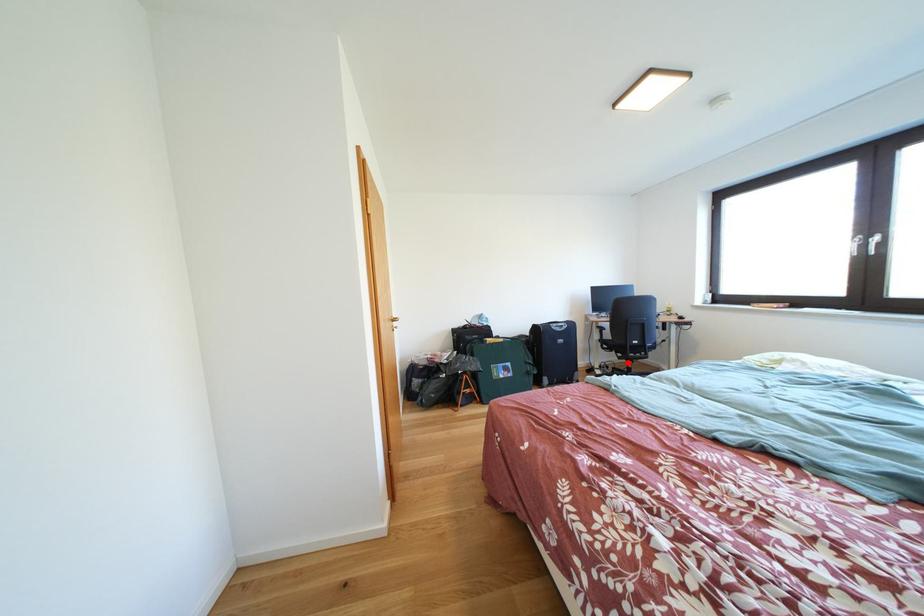
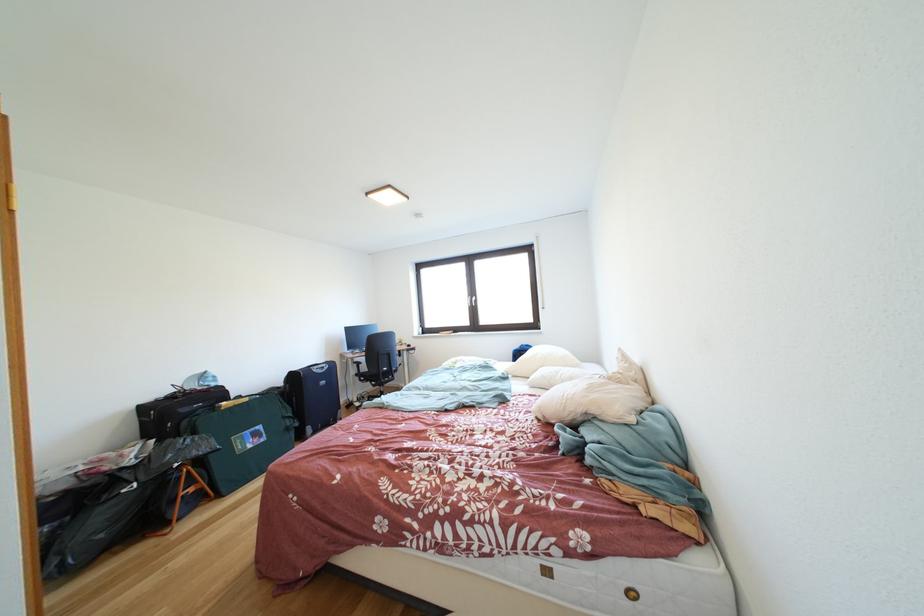
Question: I am providing you with two images of the same scene from different viewpoints. A red point is marked on the first image. At the location where the point appears in image 1, is it still visible in image 2?

Choices:
 (A) Yes
 (B) No

Answer: (A)